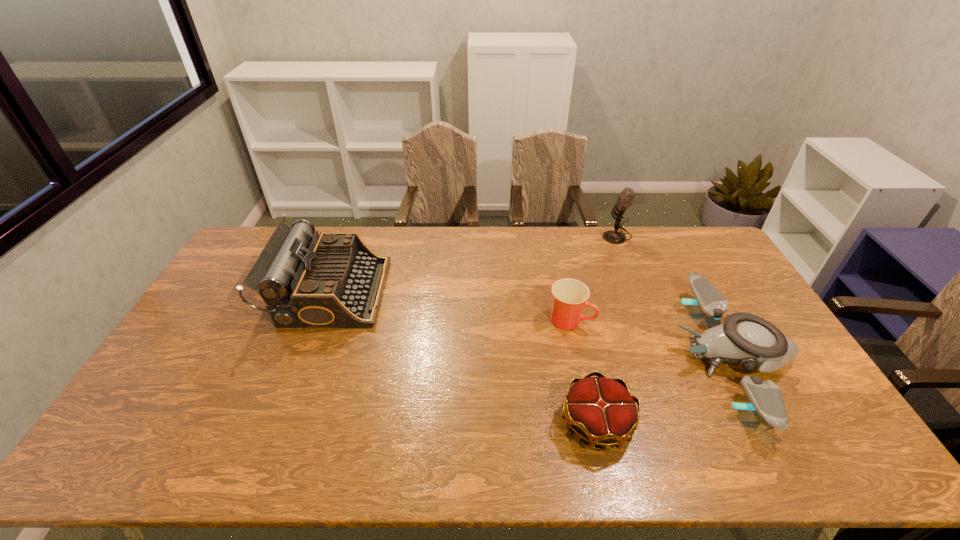
The height and width of the screenshot is (540, 960). I want to click on vacant space located on the front-facing side of the drone, so click(x=658, y=356).

Find the location of a particular element. blank area located on the front-facing side of the drone is located at coordinates (554, 356).

The image size is (960, 540). What are the coordinates of `vacant space positioned on the front-facing side of the drone` in the screenshot? It's located at (619, 356).

Where is `vacant space positioned 0.100m on the right of the crown`? vacant space positioned 0.100m on the right of the crown is located at coordinates (672, 423).

Where is `microphone that is positioned at the far edge`? The image size is (960, 540). microphone that is positioned at the far edge is located at coordinates (625, 198).

You are a GUI agent. You are given a task and a screenshot of the screen. Output one action in this format:
    pyautogui.click(x=<x>, y=<y>)
    Task: Click on the typewriter located at the far edge
    The width and height of the screenshot is (960, 540).
    Given the screenshot: What is the action you would take?
    pyautogui.click(x=333, y=279)

Identify the location of drone at the near edge. (747, 339).

What are the coordinates of `crown that is at the near edge` in the screenshot? It's located at (602, 411).

The image size is (960, 540). I want to click on object present at the right edge, so click(747, 339).

Find the location of `object positioned at the near right corner`. object positioned at the near right corner is located at coordinates (747, 339).